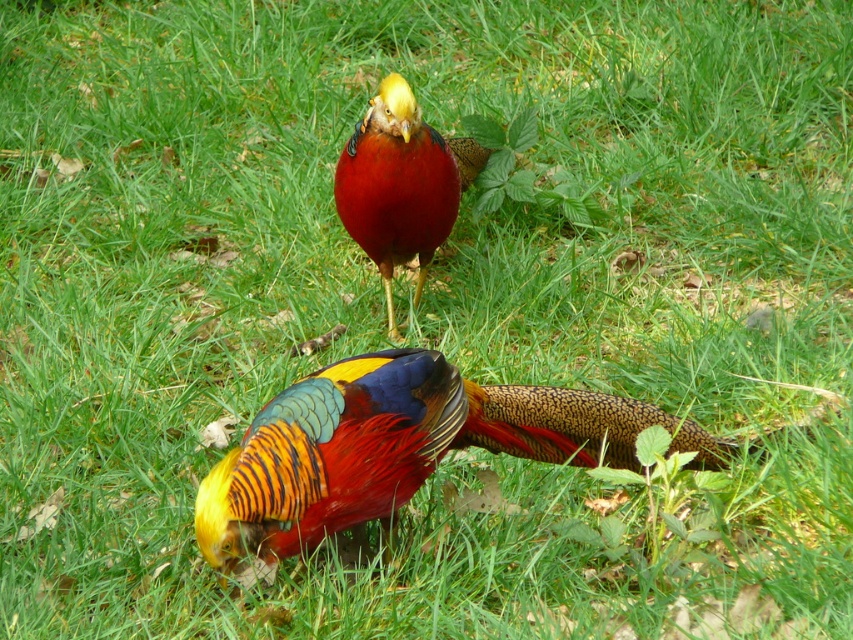
You are standing in the grassy area and see the shiny multicolored bird at center. Based on its position coordinates, can you determine if it is closer to the front or the back of the image?

The shiny multicolored bird at center is located at point coordinates of (401, 445). Since the coordinates are closer to the lower half of the image, it is positioned closer to the front of the image.

From the picture: You are a birdwatcher trying to capture both the shiny multicolored bird at center and the glossy red pheasant at center in your camera frame. Based on their positions and sizes, which bird should you focus on first to ensure both fit in the frame?

The shiny multicolored bird at center might be wider than the glossy red pheasant at center, so focusing on the wider bird first would help ensure both fit in the frame.

You are a birdwatcher observing two pheasants in the scene. You notice the shiny multicolored bird at center and the glossy red pheasant at center. Which one is closer to you?

The shiny multicolored bird at center is closer to you because it is in front of the glossy red pheasant at center.